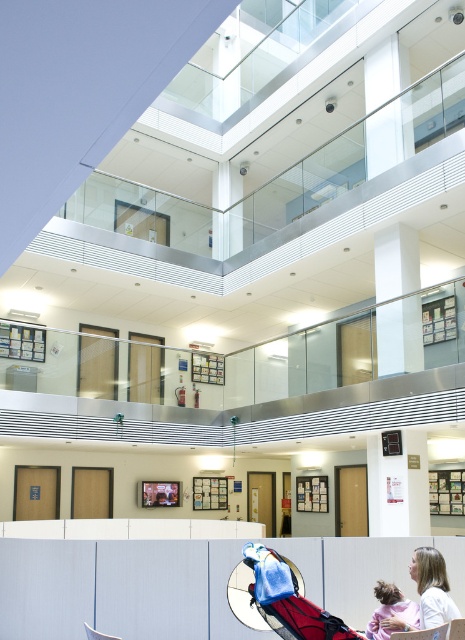
You are a photographer trying to capture a candid shot of the light brown hair at lower right and the pink fabric child at lower right. Since you want to ensure both subjects are in focus, which subject should you prioritize focusing on to account for their size differences?

The light brown hair at lower right has a greater width than the pink fabric child at lower right, so you should prioritize focusing on the light brown hair at lower right to account for its larger size.

You are a delivery person standing at the entrance of the building and need to locate the red fabric baby carriage at lower center. According to the coordinates provided, where should you look to find it?

The red fabric baby carriage at lower center is located at the coordinates point (283, 600), which means it is positioned near the lower right corner of the image.

You are a security guard in the building and need to ensure that the red fabric baby carriage at lower center and the light brown hair at lower right are visible in the surveillance camera feed. Which object will appear bigger on the camera screen?

The red fabric baby carriage at lower center will appear bigger on the camera screen because it has a larger size compared to the light brown hair at lower right.